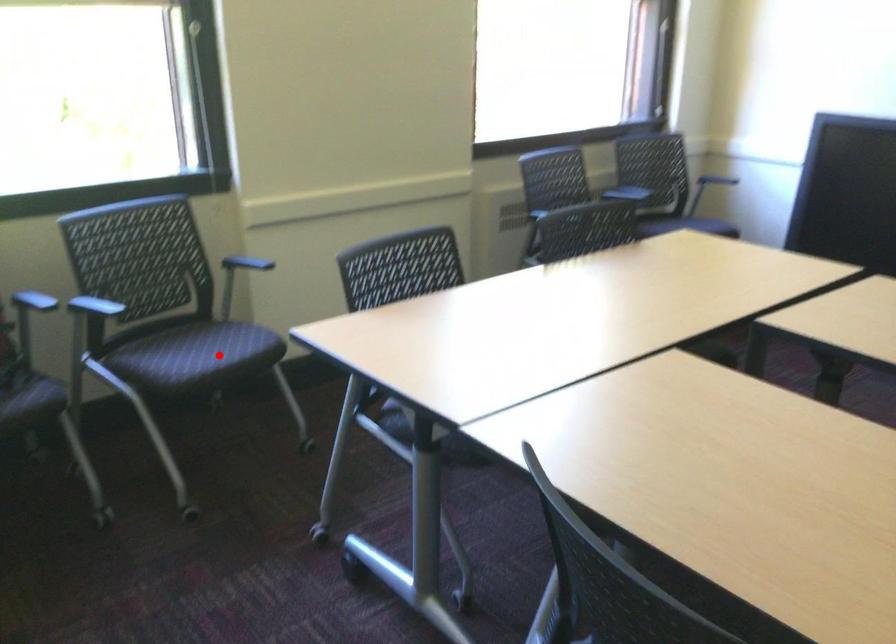
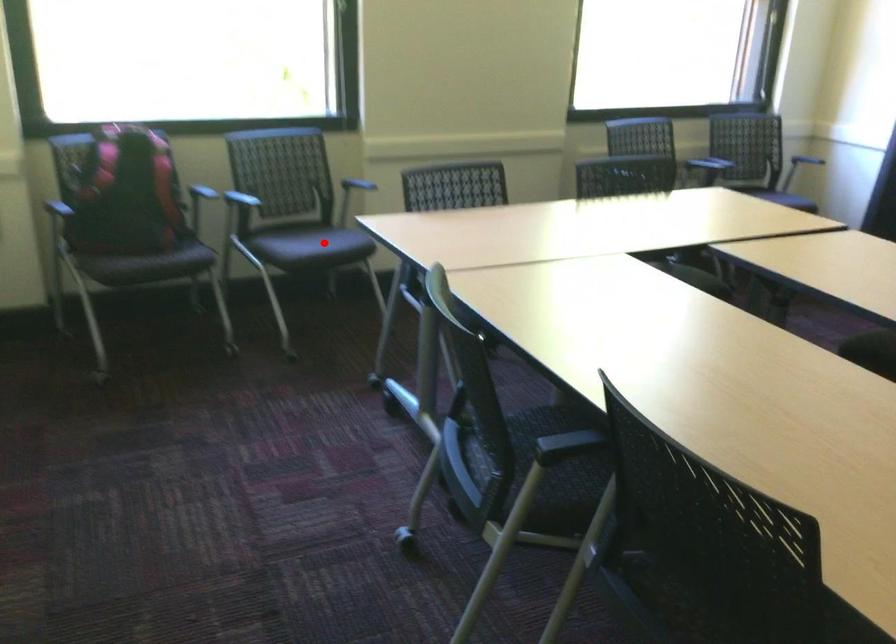
I am providing you with two images of the same scene from different viewpoints. A red point is marked on the first image and another point is marked on the second image. Is the red point in image1 aligned with the point shown in image2?

Yes